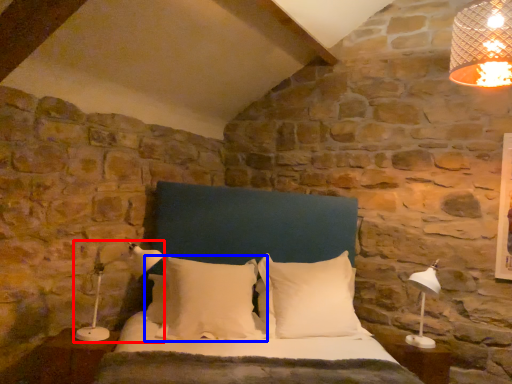
Question: Which object is closer to the camera taking this photo, lamp (highlighted by a red box) or pillow (highlighted by a blue box)?

Choices:
 (A) lamp
 (B) pillow

Answer: (A)